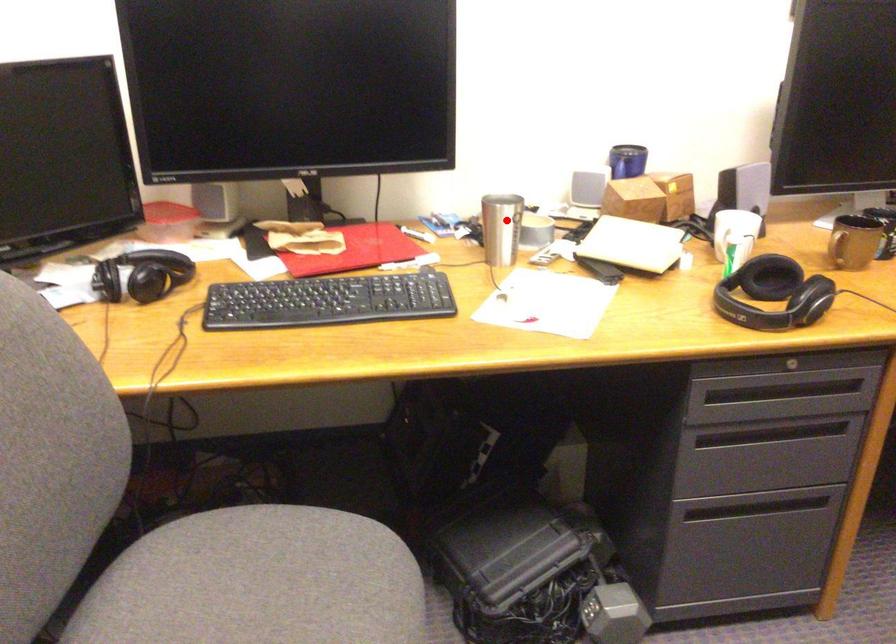
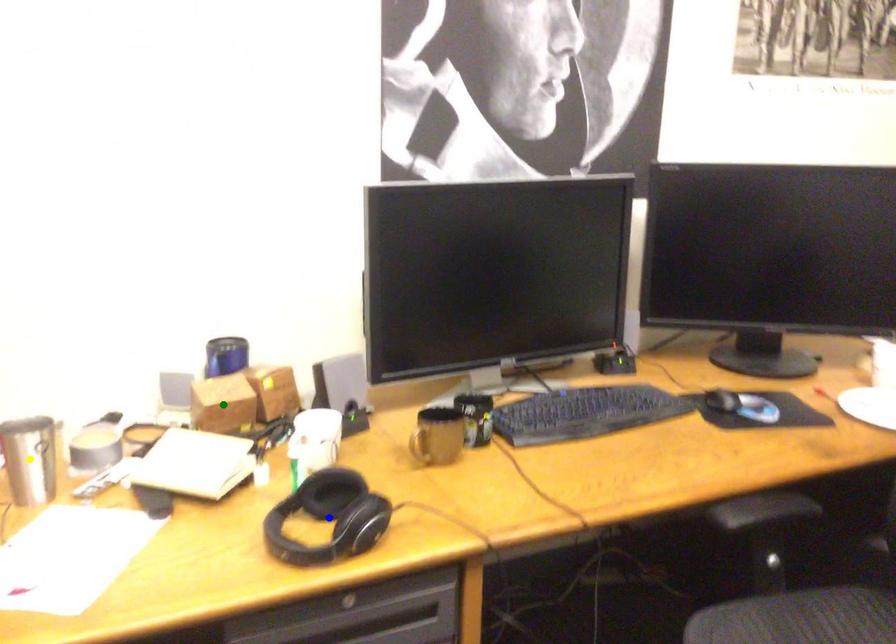
Question: I am providing you with two images of the same scene from different viewpoints. A red point is marked on the first image. You are given multiple points on the second image. Which mark in image 2 goes with the point in image 1?

Choices:
 (A) yellow point
 (B) blue point
 (C) green point

Answer: (A)